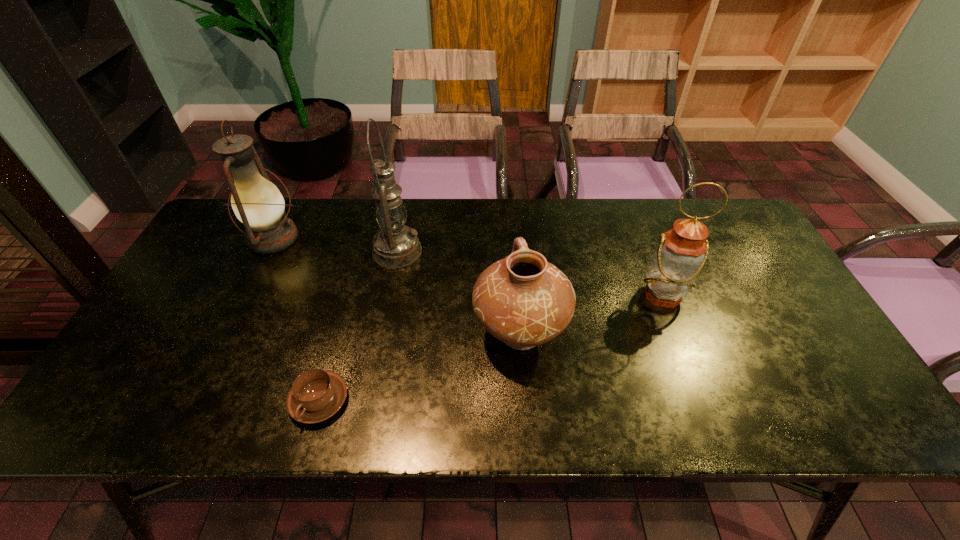
Where is `vacant position located 0.050m on the right of the nearest oil lamp`? The width and height of the screenshot is (960, 540). vacant position located 0.050m on the right of the nearest oil lamp is located at coordinates (703, 296).

Locate an element on the screen. This screenshot has width=960, height=540. vacant space situated 0.220m on the side of the second object from right to left with the handle is located at coordinates (513, 244).

Find the location of a particular element. Image resolution: width=960 pixels, height=540 pixels. vacant space located 0.380m on the side of the second object from right to left with the handle is located at coordinates (511, 211).

This screenshot has width=960, height=540. I want to click on vacant point located on the side of the second object from right to left with the handle, so click(514, 257).

Where is `object at the near edge`? Image resolution: width=960 pixels, height=540 pixels. object at the near edge is located at coordinates (316, 395).

This screenshot has width=960, height=540. Identify the location of object that is at the left edge. (257, 203).

This screenshot has height=540, width=960. In order to click on object that is at the far left corner in this screenshot , I will do `click(257, 203)`.

I want to click on blank space at the far edge of the desktop, so click(590, 211).

This screenshot has height=540, width=960. What are the coordinates of `blank space at the near edge of the desktop` in the screenshot? It's located at (781, 421).

The width and height of the screenshot is (960, 540). Identify the location of vacant area at the left edge of the desktop. (197, 315).